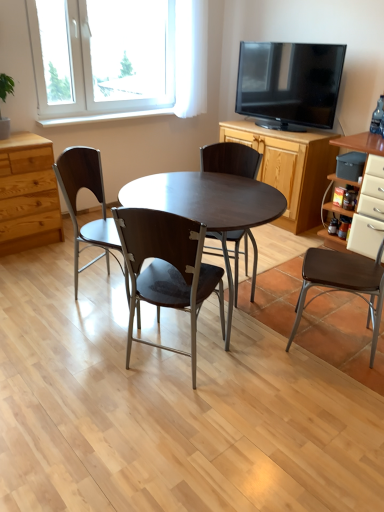
Locate an element on the screen. The width and height of the screenshot is (384, 512). unoccupied region to the right of matte brown chair at center, marked as the 2th chair in a left-to-right arrangement is located at coordinates (264, 377).